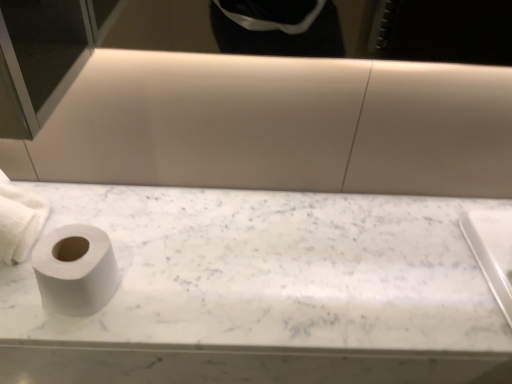
This screenshot has height=384, width=512. I want to click on free point above white marble toilet paper at left (from a real-world perspective), so click(x=290, y=257).